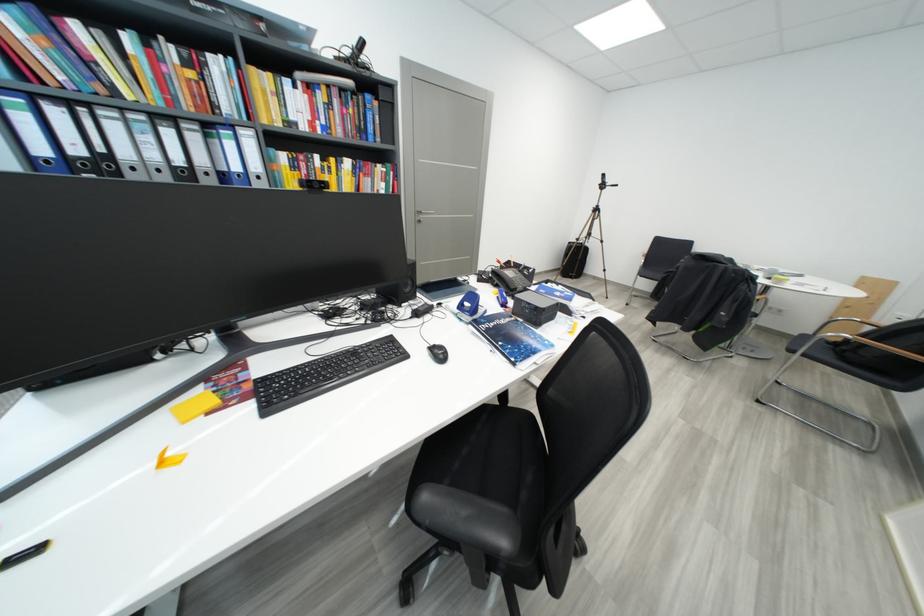
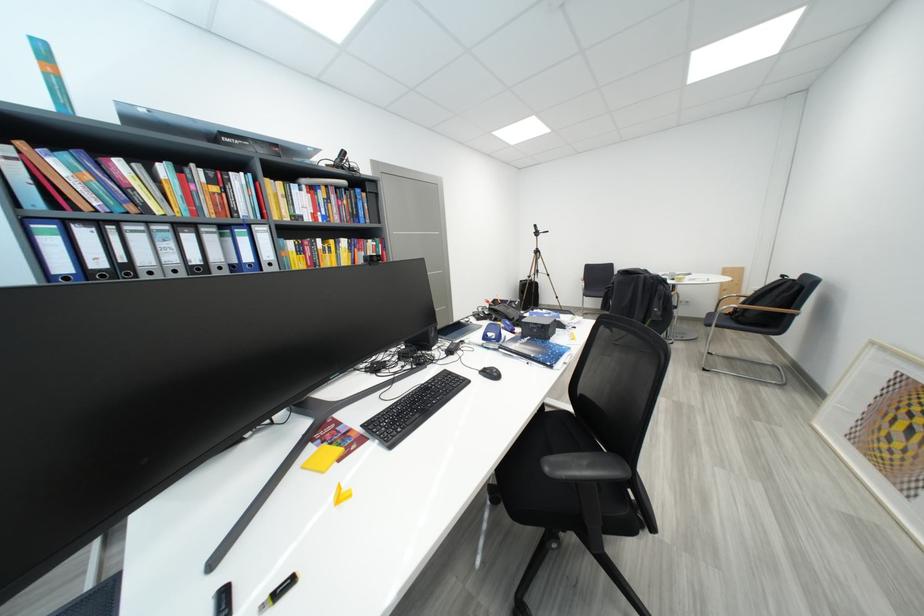
Locate, in the second image, the point that corresponds to (469,309) in the first image.

(494, 339)